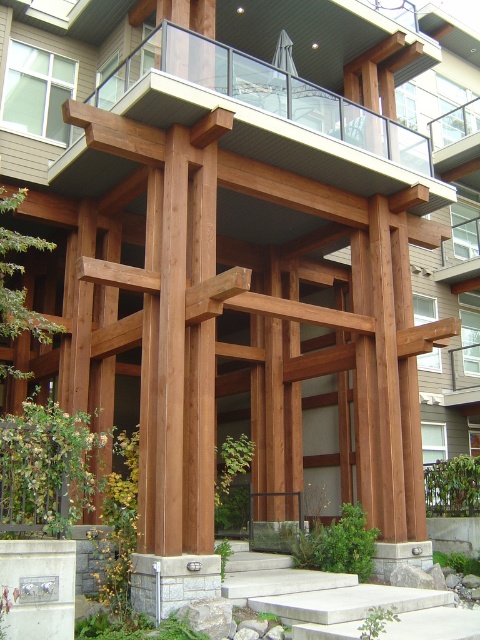
You are an architect reviewing a design plan. You notice the wooden balcony at upper center and the concrete at center in the image. Which material is positioned closer to the viewer in this architectural design?

The wooden balcony at upper center is positioned closer to the viewer than the concrete at center, as the concrete is situated behind it.

You are standing at the entrance of the residential complex and see the wooden framework forming a geometric design. There is a point labeled as point (x=265, y=108) in the image. Which part of the wooden framework does this point correspond to?

The point (x=265, y=108) corresponds to the wooden balcony at upper center.